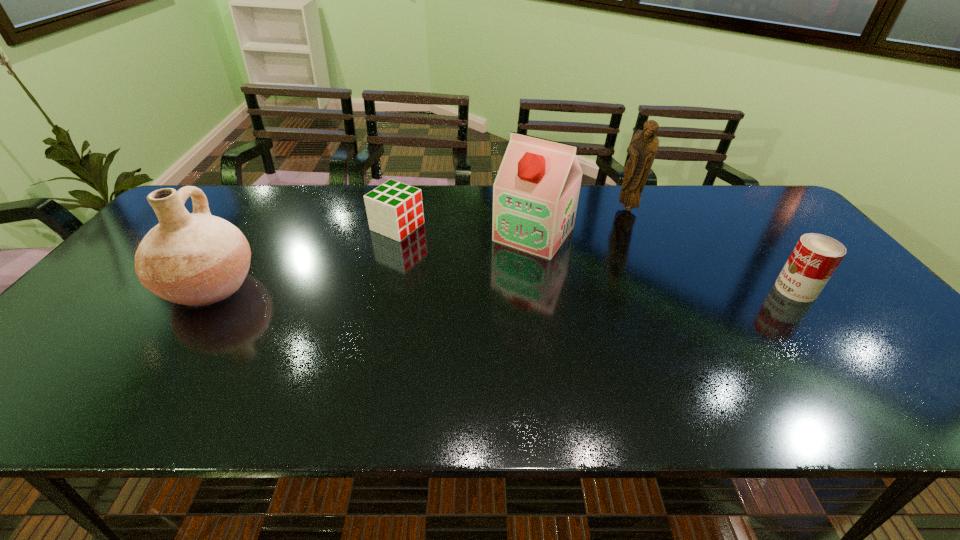
Locate an element on the screen. the leftmost object is located at coordinates (196, 259).

Image resolution: width=960 pixels, height=540 pixels. In order to click on the rightmost object in this screenshot , I will do `click(815, 257)`.

The height and width of the screenshot is (540, 960). Find the location of `can`. can is located at coordinates (815, 257).

Locate an element on the screen. The width and height of the screenshot is (960, 540). the shortest object is located at coordinates (394, 209).

What are the coordinates of `cube` in the screenshot? It's located at (394, 209).

Locate an element on the screen. This screenshot has height=540, width=960. the third object from right to left is located at coordinates (535, 194).

Where is `figurine`? The height and width of the screenshot is (540, 960). figurine is located at coordinates (643, 147).

Where is `free location located to pour from the handle of the pottery`? The height and width of the screenshot is (540, 960). free location located to pour from the handle of the pottery is located at coordinates (292, 286).

The width and height of the screenshot is (960, 540). Identify the location of free space located 0.130m on the front label of the fourth tallest object. (727, 289).

Locate an element on the screen. free space located on the front label of the fourth tallest object is located at coordinates (696, 289).